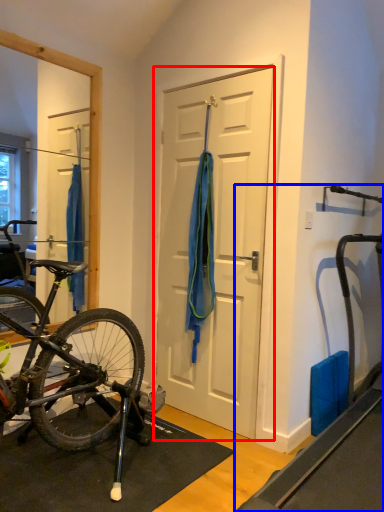
Question: Which point is further to the camera, door (highlighted by a red box) or treadmill (highlighted by a blue box)?

Choices:
 (A) door
 (B) treadmill

Answer: (A)